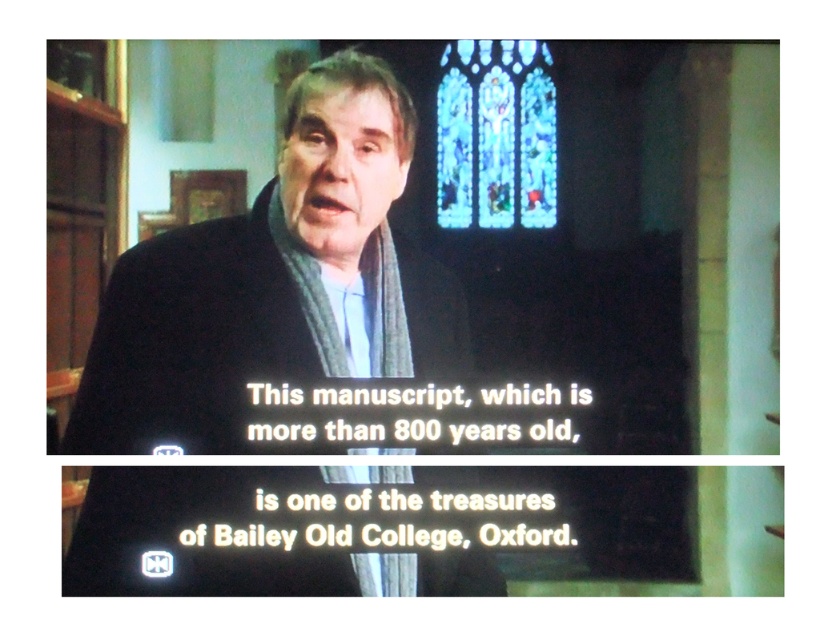
Question: Which point is farther to the camera?

Choices:
 (A) (472, 86)
 (B) (330, 556)

Answer: (A)

Question: Is dark blue woolen scarf at center thinner than stained glass at upper center?

Choices:
 (A) no
 (B) yes

Answer: (A)

Question: Is dark blue woolen scarf at center closer to camera compared to stained glass at upper center?

Choices:
 (A) yes
 (B) no

Answer: (A)

Question: Among these points, which one is farthest from the camera?

Choices:
 (A) (171, 333)
 (B) (449, 120)

Answer: (B)

Question: Is dark blue woolen scarf at center closer to camera compared to stained glass at upper center?

Choices:
 (A) yes
 (B) no

Answer: (A)